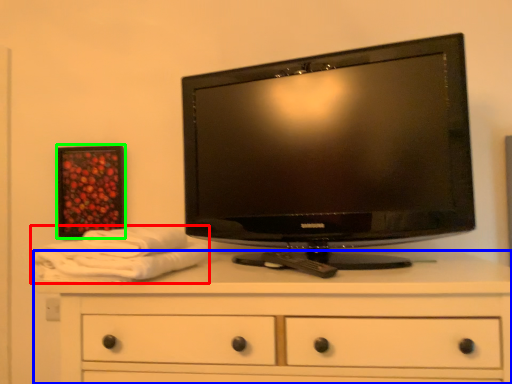
Question: Which object is the farthest from bath towel (highlighted by a red box)? Choose among these: chest of drawers (highlighted by a blue box) or picture frame (highlighted by a green box).

Choices:
 (A) chest of drawers
 (B) picture frame

Answer: (B)